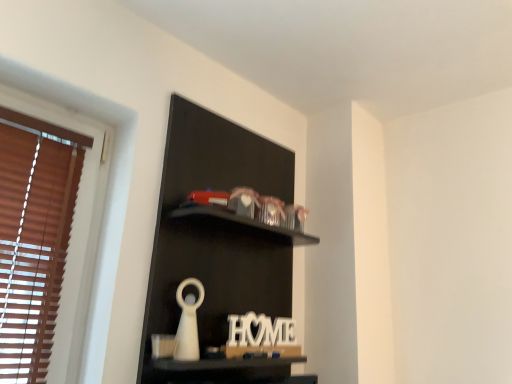
Identify the location of white wood letter at center. (260, 330).

This screenshot has height=384, width=512. Describe the element at coordinates (260, 330) in the screenshot. I see `white wood letter at center` at that location.

Describe the element at coordinates (217, 243) in the screenshot. This screenshot has height=384, width=512. I see `black matte shelf at upper center` at that location.

The image size is (512, 384). In order to click on black matte shelf at upper center in this screenshot , I will do `click(217, 243)`.

From the picture: Measure the distance between black matte shelf at upper center and camera.

black matte shelf at upper center is 1.05 meters away from camera.

At what (x,y) coordinates should I click in order to perform the action: click on white wood letter at center. Please return your answer as a coordinate pair (x, y). Looking at the image, I should click on (260, 330).

Considering the positions of objects black matte shelf at upper center and white wood letter at center in the image provided, who is more to the left, black matte shelf at upper center or white wood letter at center?

black matte shelf at upper center.

Based on the photo, considering their positions, is black matte shelf at upper center located in front of or behind white wood letter at center?

black matte shelf at upper center is in front of white wood letter at center.

Is point (253, 148) more distant than point (246, 332)?

Yes.

From the image's perspective, is black matte shelf at upper center above white wood letter at center?

Yes, from the image's perspective, black matte shelf at upper center is above white wood letter at center.

From a real-world perspective, is black matte shelf at upper center on white wood letter at center?

Yes, from a real-world perspective, black matte shelf at upper center is on top of white wood letter at center.

Looking at their sizes, would you say black matte shelf at upper center is wider or thinner than white wood letter at center?

In the image, black matte shelf at upper center appears to be wider than white wood letter at center.

Considering the relative sizes of black matte shelf at upper center and white wood letter at center in the image provided, is black matte shelf at upper center taller than white wood letter at center?

Indeed, black matte shelf at upper center has a greater height compared to white wood letter at center.

Based on their sizes in the image, would you say black matte shelf at upper center is bigger or smaller than white wood letter at center?

In the image, black matte shelf at upper center appears to be larger than white wood letter at center.

Is black matte shelf at upper center outside of white wood letter at center?

Yes, black matte shelf at upper center is not within white wood letter at center.

Would you say black matte shelf at upper center is a long distance from white wood letter at center?

No, there isn't a large distance between black matte shelf at upper center and white wood letter at center.

Could you tell me if black matte shelf at upper center is turned towards white wood letter at center?

Yes, black matte shelf at upper center is oriented towards white wood letter at center.

This screenshot has width=512, height=384. I want to click on shelf in front of the white wood letter at center, so click(x=217, y=243).

Which object is positioned more to the right, white wood letter at center or black matte shelf at upper center?

From the viewer's perspective, white wood letter at center appears more on the right side.

Considering their positions, is white wood letter at center located in front of or behind black matte shelf at upper center?

Clearly, white wood letter at center is behind black matte shelf at upper center.

Considering the positions of point (263, 320) and point (275, 192), is point (263, 320) closer or farther from the camera than point (275, 192)?

Point (263, 320) is closer to the camera than point (275, 192).

From the image's perspective, would you say white wood letter at center is shown under black matte shelf at upper center?

Yes.

From a real-world perspective, which object stands above the other?

black matte shelf at upper center.

Can you confirm if white wood letter at center is wider than black matte shelf at upper center?

No.

Is white wood letter at center taller or shorter than black matte shelf at upper center?

Clearly, white wood letter at center is shorter compared to black matte shelf at upper center.

Can you confirm if white wood letter at center is smaller than black matte shelf at upper center?

Indeed, white wood letter at center has a smaller size compared to black matte shelf at upper center.

Which is correct: white wood letter at center is inside black matte shelf at upper center, or outside of it?

white wood letter at center is located inside black matte shelf at upper center.

In the scene shown: Are white wood letter at center and black matte shelf at upper center making contact?

No, white wood letter at center is not in contact with black matte shelf at upper center.

Is white wood letter at center facing away from black matte shelf at upper center?

Yes, white wood letter at center is positioned with its back facing black matte shelf at upper center.

Can you tell me how much white wood letter at center and black matte shelf at upper center differ in facing direction?

The angle between the facing direction of white wood letter at center and the facing direction of black matte shelf at upper center is 1.66 degrees.

Looking at this image, measure the distance between white wood letter at center and black matte shelf at upper center.

A distance of 9.82 inches exists between white wood letter at center and black matte shelf at upper center.

Where is `shelf above the white wood letter at center (from the image's perspective)`? The image size is (512, 384). shelf above the white wood letter at center (from the image's perspective) is located at coordinates (217, 243).

Where is `shelf above the white wood letter at center (from the image's perspective)`? The image size is (512, 384). shelf above the white wood letter at center (from the image's perspective) is located at coordinates (217, 243).

In the image, there is a black matte shelf at upper center. At what (x,y) coordinates should I click in order to perform the action: click on letter below it (from the image's perspective). Please return your answer as a coordinate pair (x, y). This screenshot has height=384, width=512. Looking at the image, I should click on (260, 330).